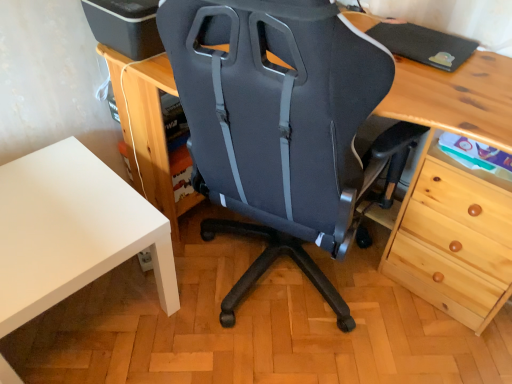
Where is `free space above white matte table at lower left (from a real-world perspective)`? The image size is (512, 384). free space above white matte table at lower left (from a real-world perspective) is located at coordinates (49, 206).